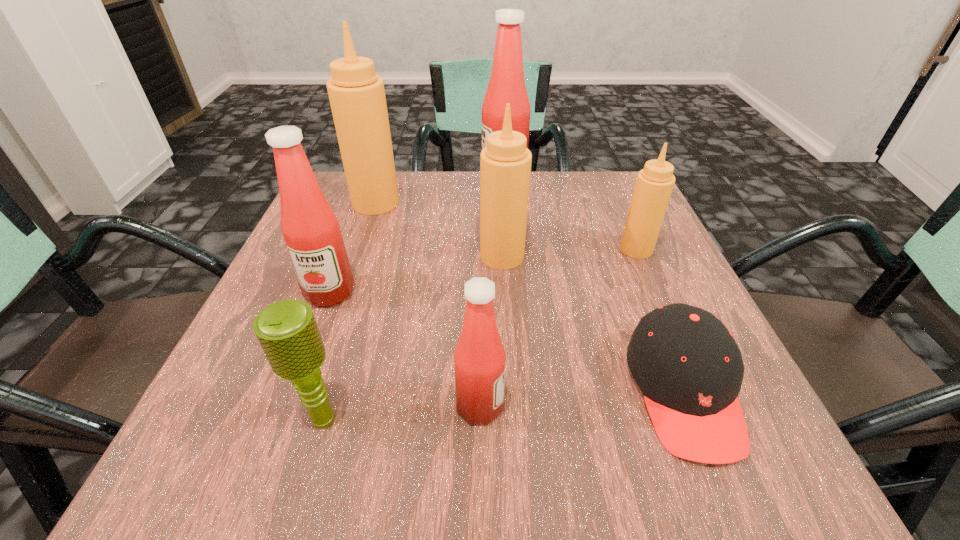
Find the location of `the farthest red condiment`. the farthest red condiment is located at coordinates (506, 85).

I want to click on the farthest tan condiment, so click(x=357, y=97).

Where is `the leftmost tan condiment`? This screenshot has height=540, width=960. the leftmost tan condiment is located at coordinates 357,97.

Find the location of `the second smallest tan condiment`. the second smallest tan condiment is located at coordinates (505, 163).

Locate an element on the screen. The height and width of the screenshot is (540, 960). the fifth farthest condiment is located at coordinates (311, 231).

The width and height of the screenshot is (960, 540). Identify the location of the fifth farthest object. (311, 231).

Locate an element on the screen. The width and height of the screenshot is (960, 540). the rightmost condiment is located at coordinates (654, 184).

Where is `the smallest tan condiment`? the smallest tan condiment is located at coordinates (654, 184).

The height and width of the screenshot is (540, 960). Find the location of `the nearest red condiment`. the nearest red condiment is located at coordinates (479, 359).

Where is `the smallest red condiment`? Image resolution: width=960 pixels, height=540 pixels. the smallest red condiment is located at coordinates (479, 359).